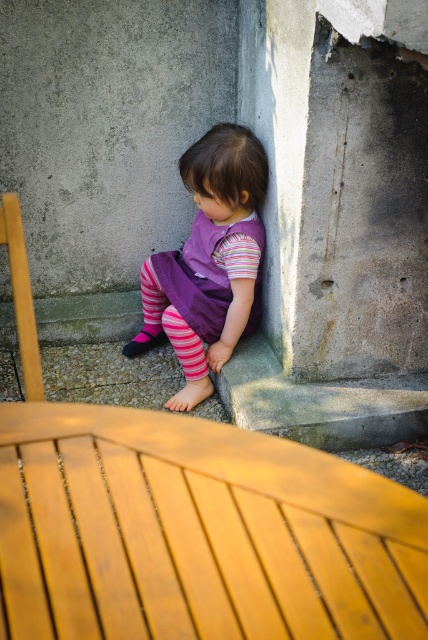
You are a fashion designer observing the image. You notice two purple dresses. Which one is closer to you, the purple fabric dress at lower center or the purple cotton dress at center?

Answer: The purple fabric dress at lower center is closer to you because it is in front of the purple cotton dress at center.

You are standing in the scene and see the point marked at coordinates (210,260). What object is located at that point?

The point at coordinates (210,260) indicates the purple fabric dress at lower center.